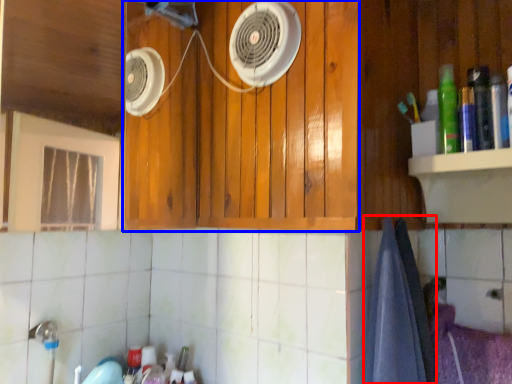
Question: Which object is closer to the camera taking this photo, bath towel (highlighted by a red box) or cabinetry (highlighted by a blue box)?

Choices:
 (A) bath towel
 (B) cabinetry

Answer: (A)